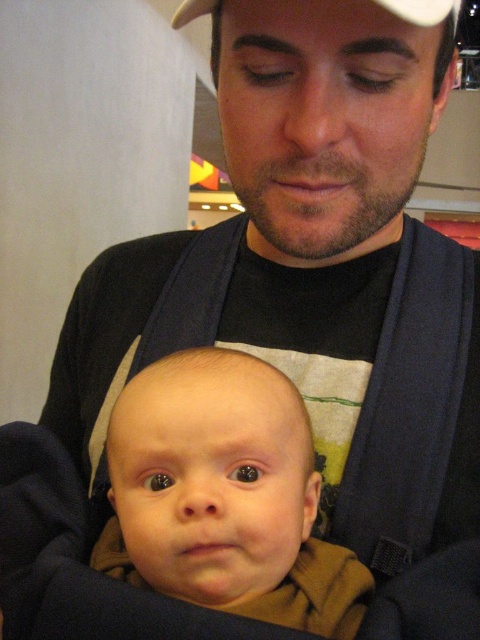
Based on the photo, you are a photographer trying to capture a closeup of the white matte baseball cap at upper center. However, the brown soft fabric baby at center is blocking your view. Can you adjust your position to see the cap without moving the baby?

The brown soft fabric baby at center is below the white matte baseball cap at upper center, so you can move your camera upwards to capture the cap without moving the baby.

You are standing in the indoor setting shown in the image. There are two points marked in the scene. The first point is at coordinates point (317, 548) and the second point is at point (409, 20). Which of these two points is closer to you?

Point (317, 548) is further to the camera than point (409, 20), so the point closer to you is point (409, 20).

You are a photographer trying to capture a closeup shot of the brown soft fabric baby at center and the navy blue fabric strap at center. Your camera has a depth of field that can focus on objects within 8 inches. Will both subjects be in focus?

The distance between the brown soft fabric baby at center and the navy blue fabric strap at center is 8.11 inches. Since the depth of field can only focus within 8 inches, the two subjects are slightly beyond the focus range. Therefore, both may not be in sharp focus simultaneously.